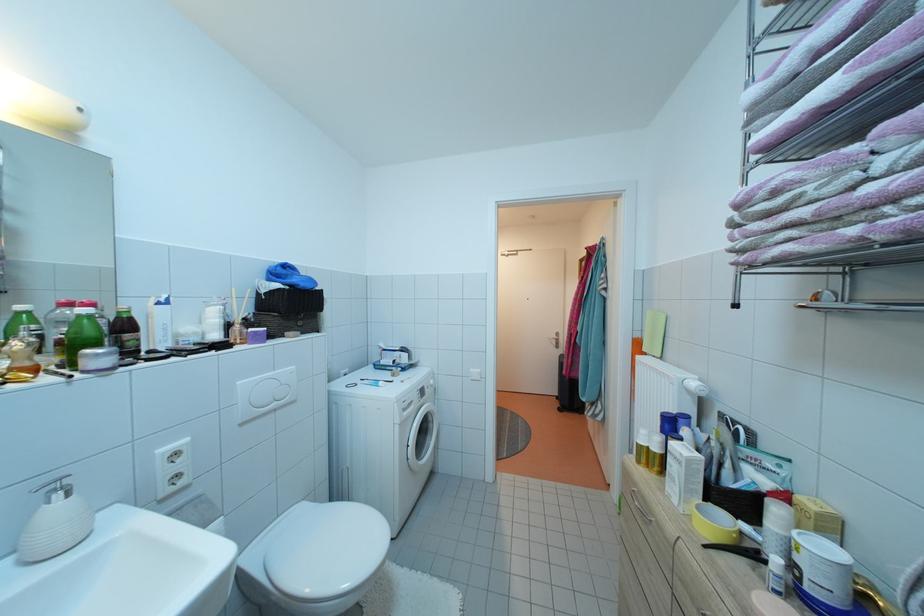
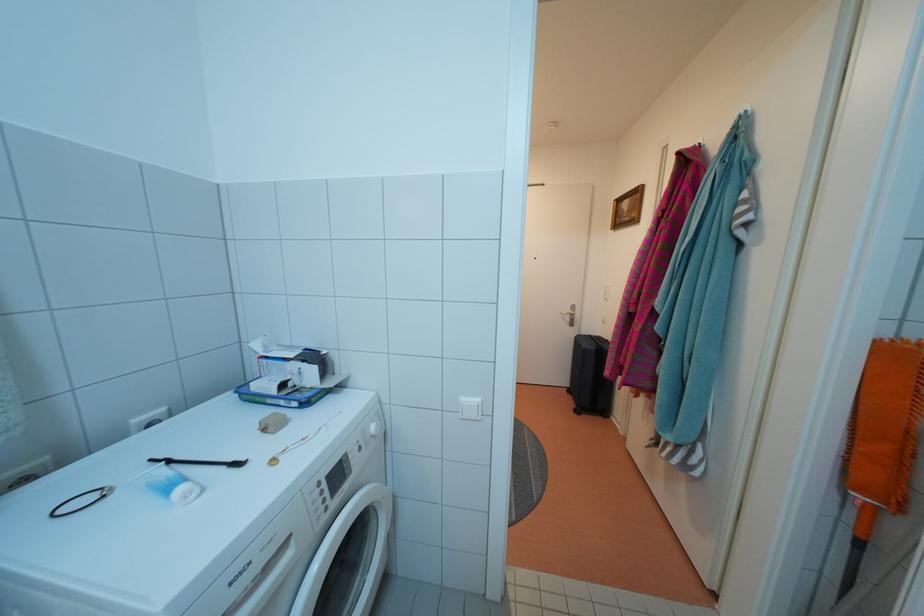
In the second image, find the point that corresponds to pixel 398 370 in the first image.

(282, 398)